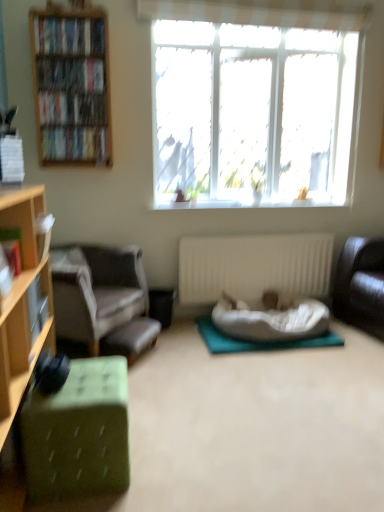
This screenshot has width=384, height=512. In order to click on vacant point above hardcover book at upper left, acting as the fourth book starting from the top (from a real-world perspective) in this screenshot , I will do `click(84, 125)`.